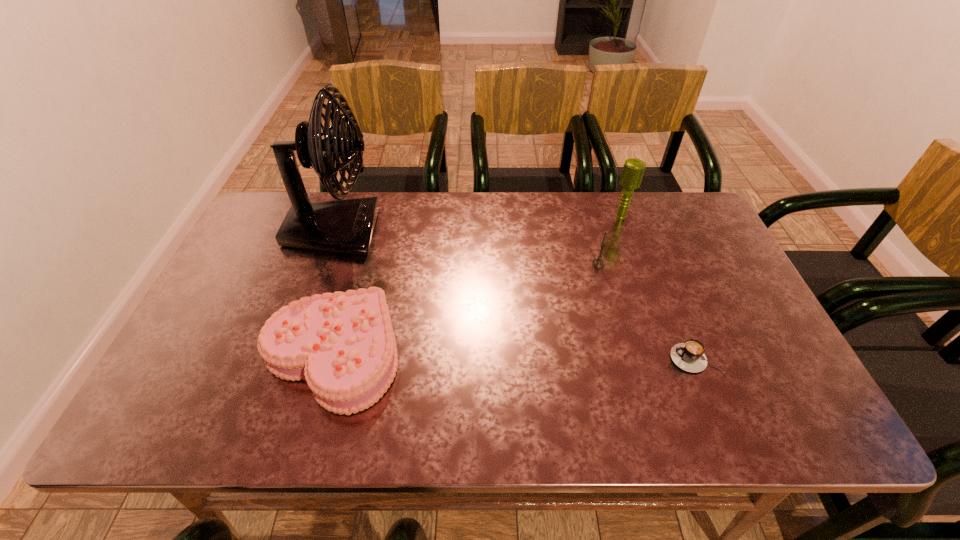
This screenshot has height=540, width=960. I want to click on free space between the cake and the tallest object, so 333,293.

The image size is (960, 540). In order to click on empty location between the cappuccino and the third object from right to left in this screenshot , I will do `click(646, 311)`.

You are a GUI agent. You are given a task and a screenshot of the screen. Output one action in this format:
    pyautogui.click(x=<x>, y=<y>)
    Task: Click on the free spot between the shortest object and the second shortest object
    
    Given the screenshot: What is the action you would take?
    pyautogui.click(x=514, y=356)

Select which object appears as the fourth closest to the microphone. Please provide its 2D coordinates. Your answer should be formatted as a tuple, i.e. [(x, y)], where the tuple contains the x and y coordinates of a point satisfying the conditions above.

[(346, 226)]

Find the location of `object that is the second closest to the second shortest object`. object that is the second closest to the second shortest object is located at coordinates (598, 263).

The height and width of the screenshot is (540, 960). Identify the location of vacant position in the image that satisfies the following two spatial constraints: 1. on the back side of the third object from left to right; 2. on the left side of the microphone. (586, 217).

Find the location of `free space that satisfies the following two spatial constraints: 1. in front of the third object from left to right to blow air; 2. on the left side of the fan`. free space that satisfies the following two spatial constraints: 1. in front of the third object from left to right to blow air; 2. on the left side of the fan is located at coordinates (323, 264).

I want to click on free point that satisfies the following two spatial constraints: 1. in front of the third tallest object to blow air; 2. on the right side of the fan, so click(x=323, y=264).